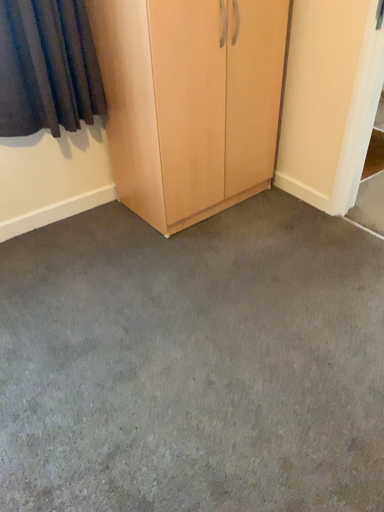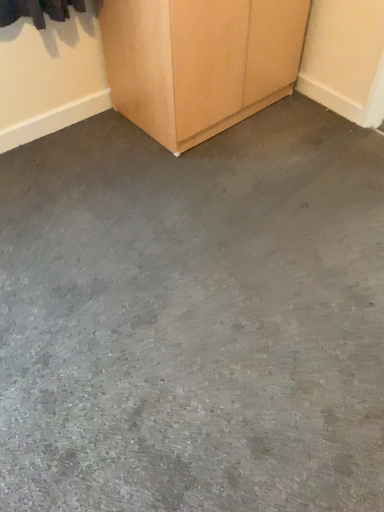
Question: Which way did the camera rotate in the video?

Choices:
 (A) rotated upward
 (B) rotated downward

Answer: (B)